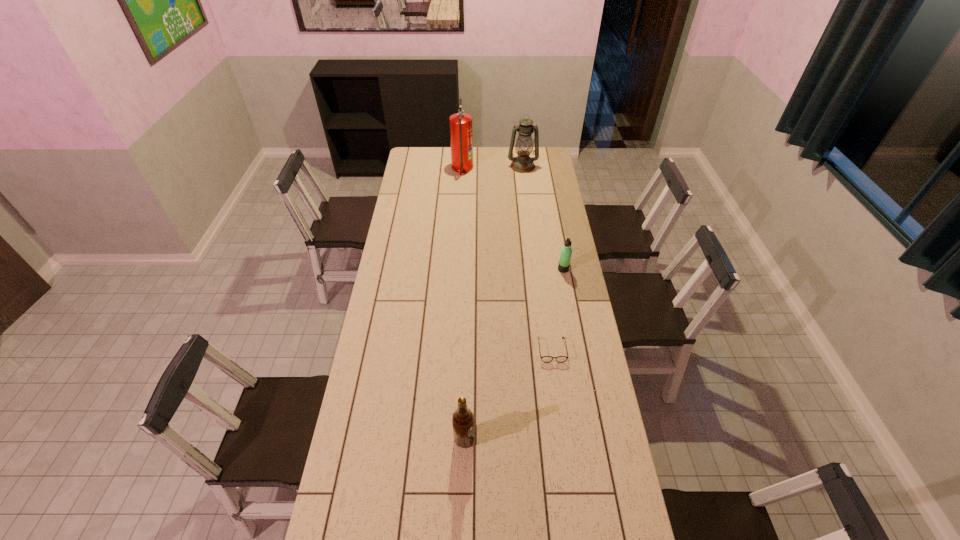
Locate an element on the screen. The height and width of the screenshot is (540, 960). unoccupied area between the spectacles and the third tallest object is located at coordinates (508, 394).

In order to click on vacant region between the nearest object and the spectacles in this screenshot , I will do `click(508, 394)`.

Where is `object that is the second closest one to the nearest object`? This screenshot has height=540, width=960. object that is the second closest one to the nearest object is located at coordinates (566, 251).

The width and height of the screenshot is (960, 540). I want to click on object identified as the third closest to the shortest object, so click(461, 127).